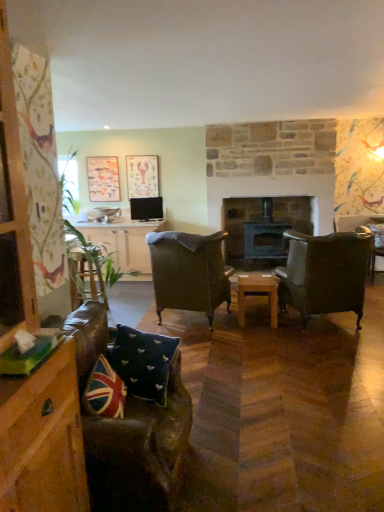
Question: Could you tell me if leather couch at lower left is turned towards union jack fabric pillow at lower left, which appears as the first pillow when viewed from the front?

Choices:
 (A) yes
 (B) no

Answer: (A)

Question: Does leather couch at lower left appear on the left side of union jack fabric pillow at lower left, which appears as the first pillow when viewed from the front?

Choices:
 (A) no
 (B) yes

Answer: (B)

Question: Can you confirm if leather couch at lower left is thinner than union jack fabric pillow at lower left, acting as the second pillow starting from the back?

Choices:
 (A) no
 (B) yes

Answer: (A)

Question: Is leather couch at lower left to the right of union jack fabric pillow at lower left, which appears as the first pillow when viewed from the front, from the viewer's perspective?

Choices:
 (A) yes
 (B) no

Answer: (B)

Question: Is leather couch at lower left taller than union jack fabric pillow at lower left, which appears as the first pillow when viewed from the front?

Choices:
 (A) yes
 (B) no

Answer: (A)

Question: Is leather couch at lower left smaller than union jack fabric pillow at lower left, acting as the second pillow starting from the back?

Choices:
 (A) yes
 (B) no

Answer: (B)

Question: Does matte pink paper at upper center, the second picture frame viewed from the left, have a greater width compared to dark brown wood fireplace at center?

Choices:
 (A) no
 (B) yes

Answer: (A)

Question: Can you confirm if matte pink paper at upper center, the second picture frame viewed from the left, is bigger than dark brown wood fireplace at center?

Choices:
 (A) yes
 (B) no

Answer: (B)

Question: From a real-world perspective, does matte pink paper at upper center, the second picture frame viewed from the left, stand above dark brown wood fireplace at center?

Choices:
 (A) no
 (B) yes

Answer: (B)

Question: Is matte pink paper at upper center, which is counted as the 1th picture frame, starting from the right, facing towards dark brown wood fireplace at center?

Choices:
 (A) no
 (B) yes

Answer: (A)

Question: Does matte pink paper at upper center, the second picture frame viewed from the left, have a smaller size compared to dark brown wood fireplace at center?

Choices:
 (A) yes
 (B) no

Answer: (A)

Question: Is matte pink paper at upper center, the second picture frame viewed from the left, not near dark brown wood fireplace at center?

Choices:
 (A) no
 (B) yes

Answer: (B)

Question: Can you confirm if wooden table at center is smaller than matte wooden picture frame at upper left, arranged as the 2th picture frame when viewed from the right?

Choices:
 (A) no
 (B) yes

Answer: (A)